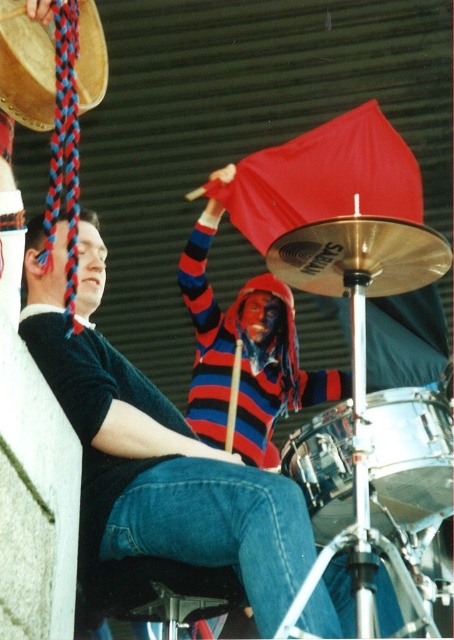
Can you confirm if striped sweater at center is positioned to the right of denim at left?

No, striped sweater at center is not to the right of denim at left.

What do you see at coordinates (156, 451) in the screenshot? The height and width of the screenshot is (640, 454). I see `striped sweater at center` at bounding box center [156, 451].

Which is in front, point (89, 256) or point (252, 561)?

Positioned in front is point (252, 561).

At what (x,y) coordinates should I click in order to perform the action: click on striped sweater at center. Please return your answer as a coordinate pair (x, y). This screenshot has height=640, width=454. Looking at the image, I should click on (156, 451).

Does point (177, 273) come closer to viewer compared to point (34, 116)?

No.

How much distance is there between striped wool sweater at center and wooden drum at upper left?

They are 17.59 meters apart.

Is point (266, 460) positioned in front of point (103, 45)?

No, it is behind (103, 45).

Identify the location of striped wool sweater at center. Image resolution: width=454 pixels, height=640 pixels. (246, 355).

Is striped wool sweater at center positioned behind shiny silver drum at center?

Yes, striped wool sweater at center is behind shiny silver drum at center.

Find the location of a particular element. striped wool sweater at center is located at coordinates (246, 355).

Which is in front, point (206, 278) or point (424, 401)?

Point (424, 401) is in front.

Locate an element on the screen. The width and height of the screenshot is (454, 640). striped wool sweater at center is located at coordinates (246, 355).